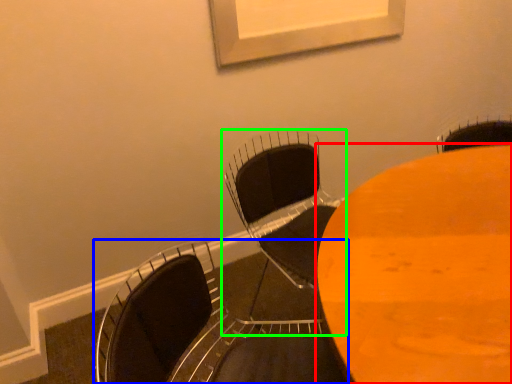
Question: Which is farther away from table (highlighted by a red box)? chair (highlighted by a blue box) or chair (highlighted by a green box)?

Choices:
 (A) chair
 (B) chair

Answer: (B)